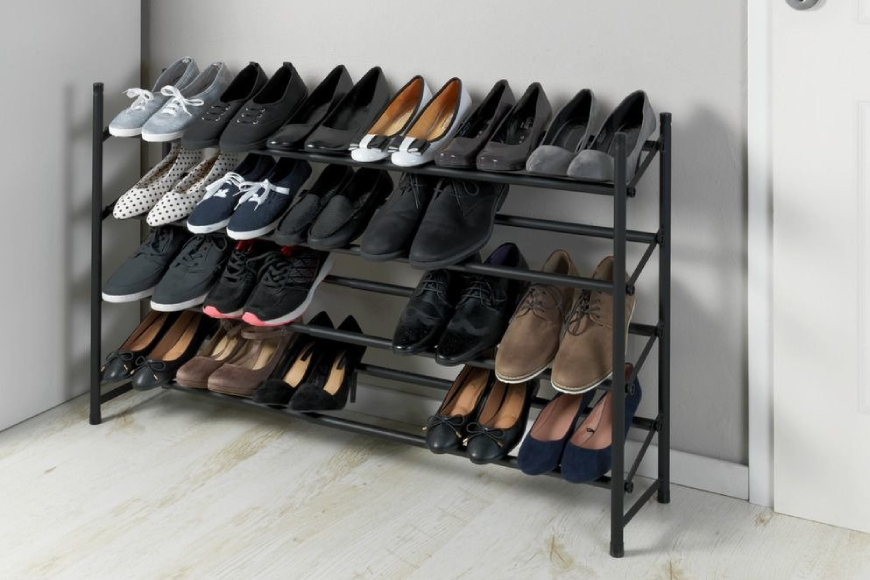
You are a GUI agent. You are given a task and a screenshot of the screen. Output one action in this format:
    pyautogui.click(x=<x>, y=<y>)
    Task: Click on the shoe on bottom shelf
    This screenshot has width=870, height=580.
    Given the screenshot: What is the action you would take?
    pyautogui.click(x=116, y=373), pyautogui.click(x=142, y=375), pyautogui.click(x=192, y=371), pyautogui.click(x=224, y=377), pyautogui.click(x=269, y=390), pyautogui.click(x=306, y=398), pyautogui.click(x=447, y=427), pyautogui.click(x=484, y=443), pyautogui.click(x=530, y=451), pyautogui.click(x=576, y=460)